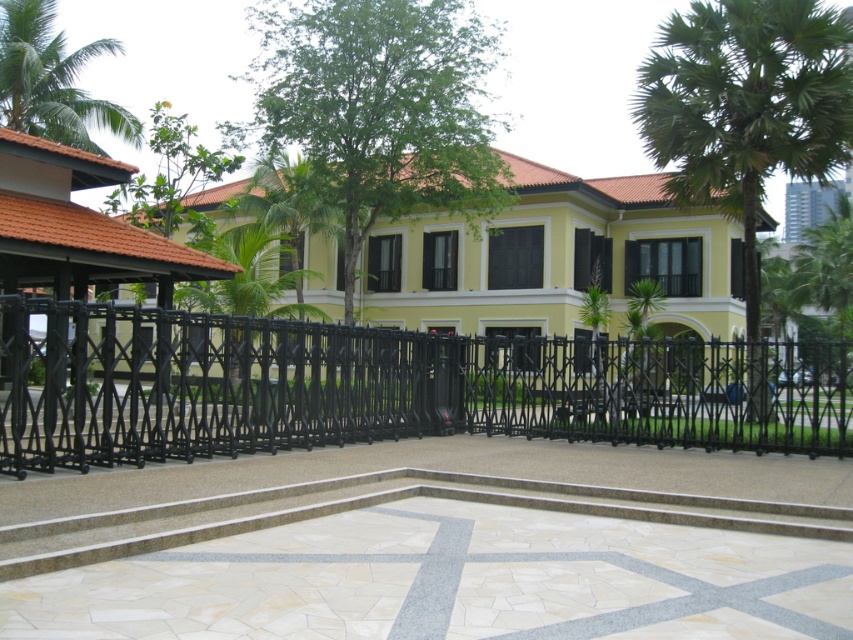
Does green leafy palm tree at upper right lie behind matte orange roof at upper left?

No, it is in front of matte orange roof at upper left.

Does green leafy palm tree at upper right have a greater height compared to matte orange roof at upper left?

Indeed, green leafy palm tree at upper right has a greater height compared to matte orange roof at upper left.

This screenshot has width=853, height=640. What do you see at coordinates (746, 115) in the screenshot?
I see `green leafy palm tree at upper right` at bounding box center [746, 115].

At what (x,y) coordinates should I click in order to perform the action: click on green leafy palm tree at upper right. Please return your answer as a coordinate pair (x, y). The image size is (853, 640). Looking at the image, I should click on (746, 115).

Can you confirm if yellow matte building at center is wider than green leafy palm tree at upper right?

Yes.

Is yellow matte building at center taller than green leafy palm tree at upper right?

Correct, yellow matte building at center is much taller as green leafy palm tree at upper right.

At what (x,y) coordinates should I click in order to perform the action: click on yellow matte building at center. Please return your answer as a coordinate pair (x, y). This screenshot has height=640, width=853. Looking at the image, I should click on (556, 260).

Does matte orange roof at upper left have a greater height compared to green leafy palm tree at upper left?

No, matte orange roof at upper left is not taller than green leafy palm tree at upper left.

What do you see at coordinates (79, 227) in the screenshot?
I see `matte orange roof at upper left` at bounding box center [79, 227].

What are the coordinates of `matte orange roof at upper left` in the screenshot? It's located at (79, 227).